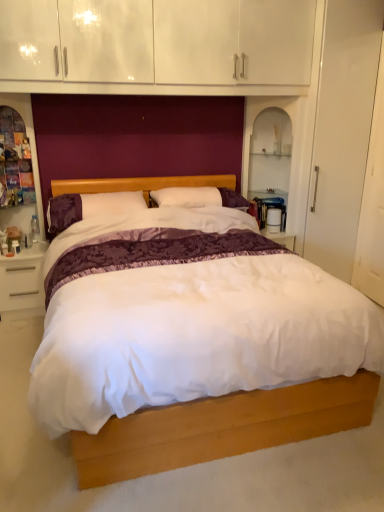
Question: From a real-world perspective, is white satin bed at center on purple velvet pillow at center?

Choices:
 (A) no
 (B) yes

Answer: (A)

Question: Is white satin bed at center at the right side of purple velvet pillow at center?

Choices:
 (A) yes
 (B) no

Answer: (A)

Question: Is white satin bed at center facing away from purple velvet pillow at center?

Choices:
 (A) no
 (B) yes

Answer: (B)

Question: Does white satin bed at center have a greater height compared to purple velvet pillow at center?

Choices:
 (A) yes
 (B) no

Answer: (A)

Question: Is the position of white satin bed at center more distant than that of purple velvet pillow at center?

Choices:
 (A) no
 (B) yes

Answer: (A)

Question: From the image's perspective, does white satin bed at center appear lower than purple velvet pillow at center?

Choices:
 (A) yes
 (B) no

Answer: (A)

Question: Does wooden dresser at left have a greater height compared to purple velvet pillow at center?

Choices:
 (A) yes
 (B) no

Answer: (A)

Question: From the image's perspective, would you say wooden dresser at left is shown under purple velvet pillow at center?

Choices:
 (A) no
 (B) yes

Answer: (A)

Question: From a real-world perspective, is wooden dresser at left on purple velvet pillow at center?

Choices:
 (A) yes
 (B) no

Answer: (A)

Question: Is wooden dresser at left to the right of purple velvet pillow at center from the viewer's perspective?

Choices:
 (A) no
 (B) yes

Answer: (A)

Question: Considering the relative sizes of wooden dresser at left and purple velvet pillow at center in the image provided, is wooden dresser at left shorter than purple velvet pillow at center?

Choices:
 (A) no
 (B) yes

Answer: (A)

Question: Does wooden dresser at left come behind purple velvet pillow at center?

Choices:
 (A) no
 (B) yes

Answer: (A)

Question: Is the surface of purple velvet pillow at center in direct contact with white glossy nightstand at lower left?

Choices:
 (A) yes
 (B) no

Answer: (B)